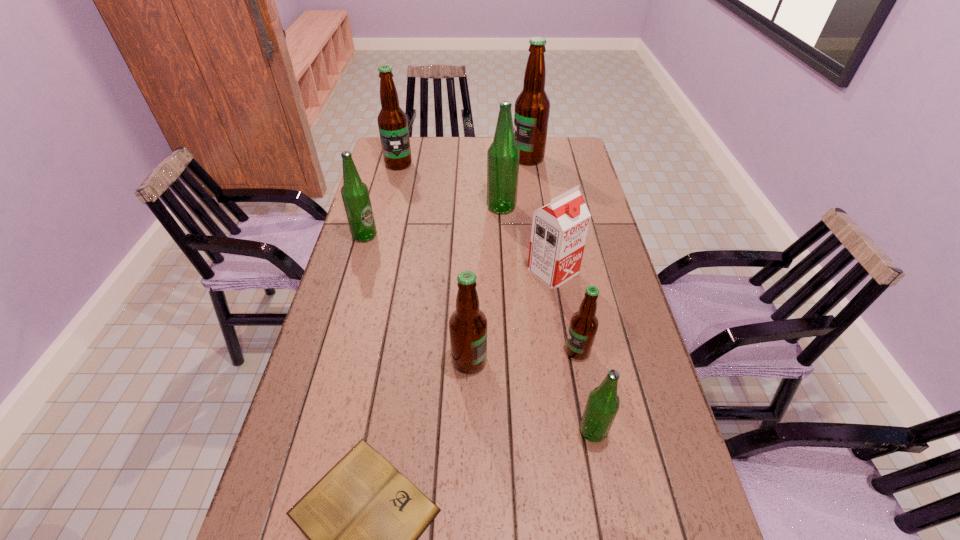
This screenshot has width=960, height=540. Identify the location of object located at the far left corner. (392, 121).

Identify the location of object located in the far right corner section of the desktop. (532, 107).

The width and height of the screenshot is (960, 540). In the image, there is a desktop. In order to click on vacant space at the far edge in this screenshot , I will do pyautogui.click(x=540, y=164).

The width and height of the screenshot is (960, 540). I want to click on free spot at the left edge of the desktop, so click(x=415, y=170).

Where is `blank space at the right edge of the desktop`? blank space at the right edge of the desktop is located at coordinates (587, 180).

Image resolution: width=960 pixels, height=540 pixels. I want to click on vacant space at the far right corner of the desktop, so click(580, 153).

Where is `free space between the fourth beer bottle from left to right and the third smallest brown beer bottle`? The height and width of the screenshot is (540, 960). free space between the fourth beer bottle from left to right and the third smallest brown beer bottle is located at coordinates (450, 186).

You are a GUI agent. You are given a task and a screenshot of the screen. Output one action in this format:
    pyautogui.click(x=<x>, y=<y>)
    Task: Click on the empty space that is in between the fifth nearest object and the third biggest brown beer bottle
    This screenshot has width=960, height=540.
    Given the screenshot: What is the action you would take?
    pyautogui.click(x=511, y=316)

Where is `free spot between the fifth object from left to right and the third smallest brown beer bottle`? The height and width of the screenshot is (540, 960). free spot between the fifth object from left to right and the third smallest brown beer bottle is located at coordinates (450, 186).

In order to click on vacant point located between the smallest brown beer bottle and the nearest beer bottle in this screenshot , I will do 585,391.